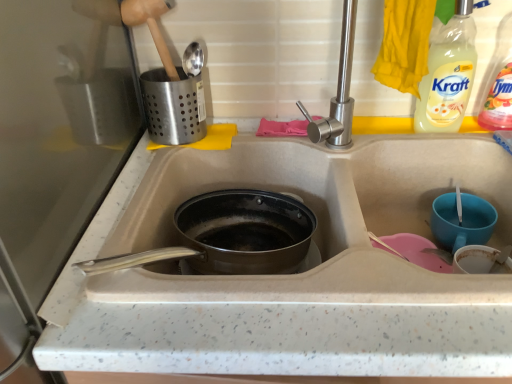
Question: From a real-world perspective, is matte gray sink at center under wooden shovel at upper left?

Choices:
 (A) no
 (B) yes

Answer: (B)

Question: Considering the relative sizes of matte gray sink at center and wooden shovel at upper left in the image provided, is matte gray sink at center thinner than wooden shovel at upper left?

Choices:
 (A) yes
 (B) no

Answer: (B)

Question: From the image's perspective, would you say matte gray sink at center is positioned over wooden shovel at upper left?

Choices:
 (A) yes
 (B) no

Answer: (B)

Question: Is matte gray sink at center positioned beyond the bounds of wooden shovel at upper left?

Choices:
 (A) yes
 (B) no

Answer: (A)

Question: Does matte gray sink at center have a greater height compared to wooden shovel at upper left?

Choices:
 (A) no
 (B) yes

Answer: (B)

Question: In terms of height, does clear plastic bottle at upper right, the first bottle positioned from the right, look taller or shorter compared to wooden shovel at upper left?

Choices:
 (A) tall
 (B) short

Answer: (A)

Question: From a real-world perspective, is clear plastic bottle at upper right, the first bottle positioned from the right, physically located above or below wooden shovel at upper left?

Choices:
 (A) below
 (B) above

Answer: (A)

Question: Considering their positions, is clear plastic bottle at upper right, the first bottle positioned from the right, located in front of or behind wooden shovel at upper left?

Choices:
 (A) front
 (B) behind

Answer: (A)

Question: Would you say clear plastic bottle at upper right, the 2th bottle positioned from the left, is to the left or to the right of wooden shovel at upper left in the picture?

Choices:
 (A) right
 (B) left

Answer: (A)

Question: Considering the positions of point (156, 4) and point (453, 253), is point (156, 4) closer or farther from the camera than point (453, 253)?

Choices:
 (A) farther
 (B) closer

Answer: (A)

Question: Is wooden shovel at upper left bigger or smaller than blue glossy cup at right?

Choices:
 (A) big
 (B) small

Answer: (A)

Question: Considering their positions, is wooden shovel at upper left located in front of or behind blue glossy cup at right?

Choices:
 (A) front
 (B) behind

Answer: (B)

Question: From the image's perspective, is wooden shovel at upper left located above or below blue glossy cup at right?

Choices:
 (A) above
 (B) below

Answer: (A)

Question: Would you say clear plastic bottle at upper right, the first bottle positioned from the right, is to the left or to the right of blue glossy cup at right in the picture?

Choices:
 (A) left
 (B) right

Answer: (B)

Question: Which is correct: clear plastic bottle at upper right, the 2th bottle positioned from the left, is inside blue glossy cup at right, or outside of it?

Choices:
 (A) outside
 (B) inside

Answer: (A)